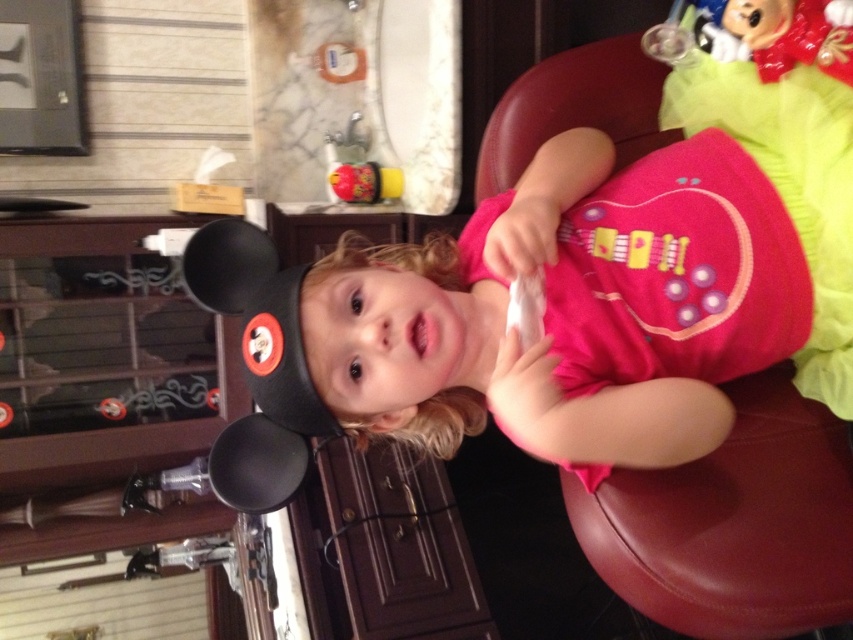
Question: Which point is closer to the camera?

Choices:
 (A) leather at right
 (B) blonde curly hair at center
 (C) shiny plastic toy at center

Answer: (A)

Question: From the image, what is the correct spatial relationship of leather at right in relation to blonde curly hair at center?

Choices:
 (A) left
 (B) right

Answer: (B)

Question: Is leather at right thinner than blonde curly hair at center?

Choices:
 (A) no
 (B) yes

Answer: (A)

Question: Which of the following is the closest to the observer?

Choices:
 (A) 337,173
 (B) 312,266
 (C) 747,400

Answer: (B)

Question: Which object appears closest to the camera in this image?

Choices:
 (A) leather at right
 (B) blonde curly hair at center
 (C) shiny plastic toy at center

Answer: (A)

Question: Does leather at right have a lesser width compared to shiny plastic toy at center?

Choices:
 (A) no
 (B) yes

Answer: (A)